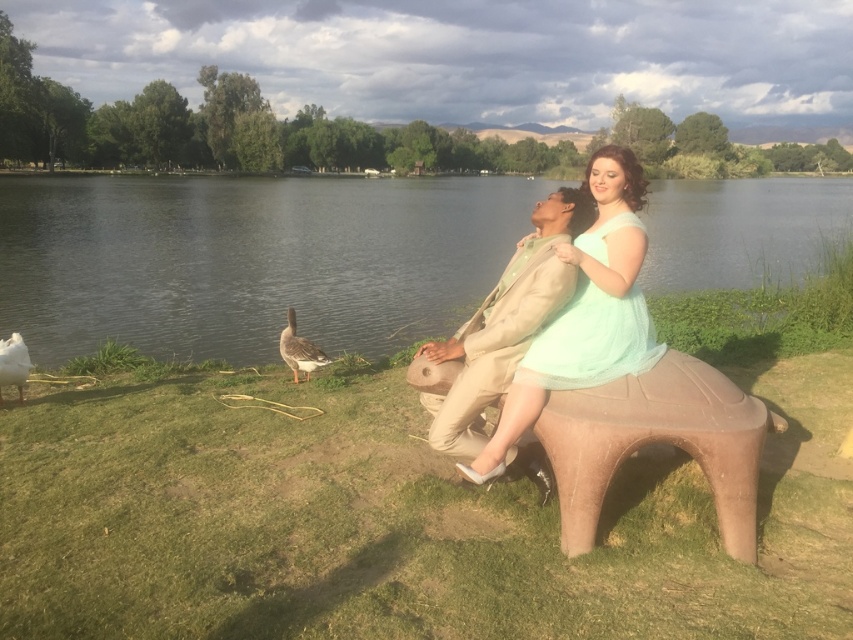
Question: Can you confirm if clear water at center is positioned to the right of brown matte duck at lower center?

Choices:
 (A) yes
 (B) no

Answer: (B)

Question: Which of the following is the closest to the observer?

Choices:
 (A) (621, 420)
 (B) (4, 348)
 (C) (500, 294)

Answer: (A)

Question: Is brown matte duck at lower center further to camera compared to white matte duck at lower left?

Choices:
 (A) yes
 (B) no

Answer: (A)

Question: Does brown matte duck at lower center have a lesser width compared to white matte duck at lower left?

Choices:
 (A) no
 (B) yes

Answer: (A)

Question: Among these objects, which one is nearest to the camera?

Choices:
 (A) beige fabric jacket at center
 (B) clear water at center

Answer: (A)

Question: Which of the following is the farthest from the observer?

Choices:
 (A) white matte duck at lower left
 (B) beige fabric jacket at center
 (C) brown plastic bench at center

Answer: (A)